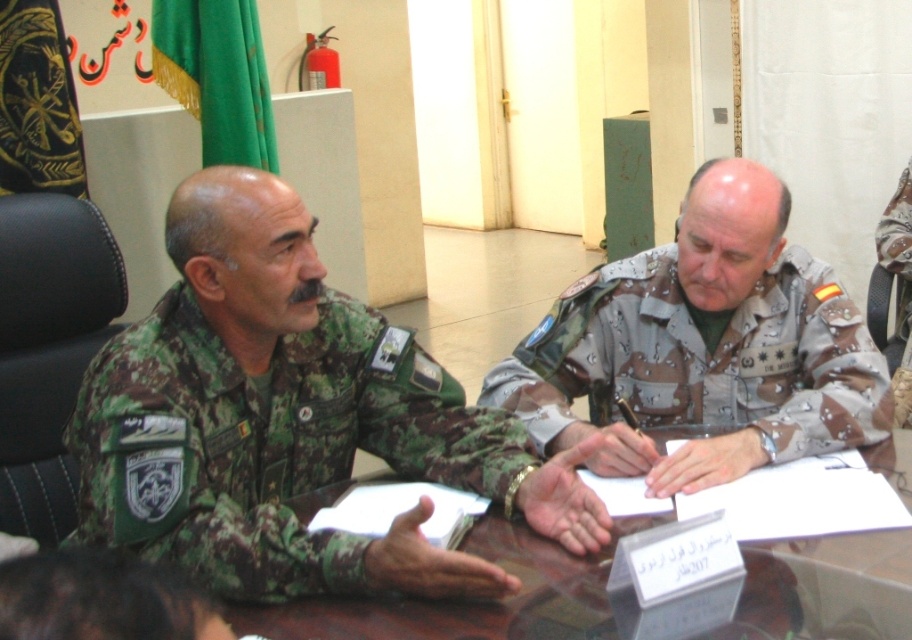
Can you confirm if camouflage uniform at left is positioned to the left of camouflage fabric uniform at center?

Indeed, camouflage uniform at left is positioned on the left side of camouflage fabric uniform at center.

Is camouflage uniform at left above camouflage fabric uniform at center?

No, camouflage uniform at left is not above camouflage fabric uniform at center.

I want to click on camouflage uniform at left, so click(x=289, y=419).

Locate an element on the screen. camouflage uniform at left is located at coordinates (289, 419).

Does point (364, 385) come in front of point (555, 636)?

No, (364, 385) is further to viewer.

Is camouflage uniform at left to the right of transparent glass table at center from the viewer's perspective?

No, camouflage uniform at left is not to the right of transparent glass table at center.

Is point (356, 545) more distant than point (612, 548)?

That is False.

Identify the location of camouflage uniform at left. (289, 419).

Does camouflage fabric uniform at center have a greater width compared to transparent glass table at center?

In fact, camouflage fabric uniform at center might be narrower than transparent glass table at center.

Does point (734, 332) come closer to viewer compared to point (368, 612)?

No, (734, 332) is further to viewer.

Does point (591, 396) lie in front of point (503, 628)?

No, it is behind (503, 628).

This screenshot has height=640, width=912. Find the location of `camouflage fabric uniform at center`. camouflage fabric uniform at center is located at coordinates (703, 358).